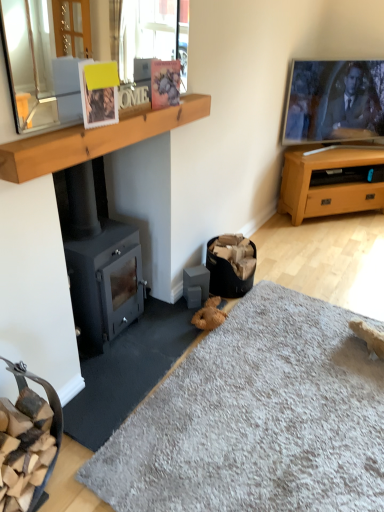
This screenshot has height=512, width=384. In order to click on vacant area that is in front of light brown wood tv stand at right in this screenshot , I will do `click(336, 243)`.